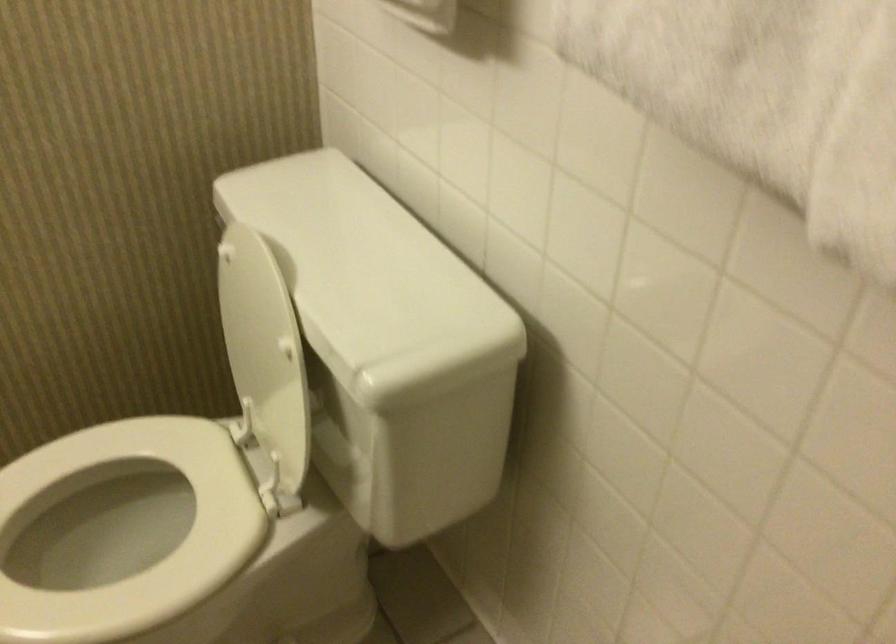
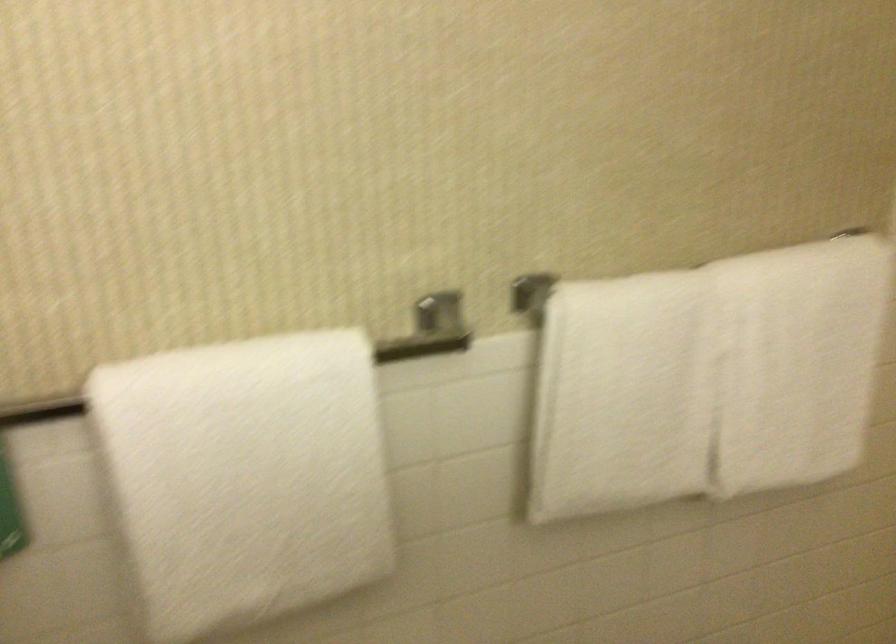
Question: The first image is from the beginning of the video and the second image is from the end. How did the camera likely rotate when shooting the video?

Choices:
 (A) Left
 (B) Right
 (C) Up
 (D) Down

Answer: (B)